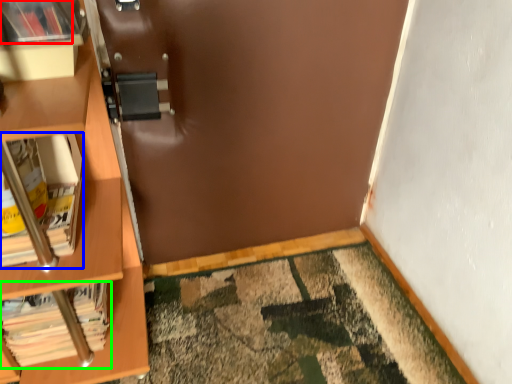
Question: Which object is the farthest from book (highlighted by a red box)? Choose among these: book (highlighted by a blue box) or book (highlighted by a green box).

Choices:
 (A) book
 (B) book

Answer: (B)